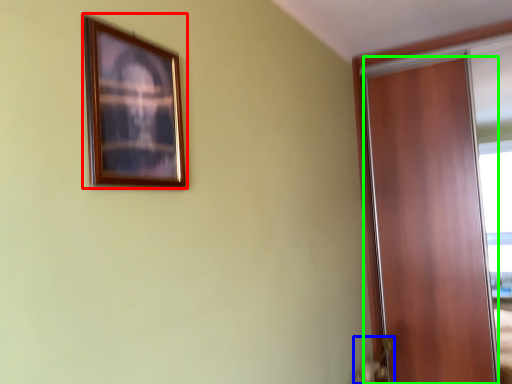
Question: Which object is the closest to the picture frame (highlighted by a red box)? Choose among these: door handle (highlighted by a blue box) or door (highlighted by a green box).

Choices:
 (A) door handle
 (B) door

Answer: (A)